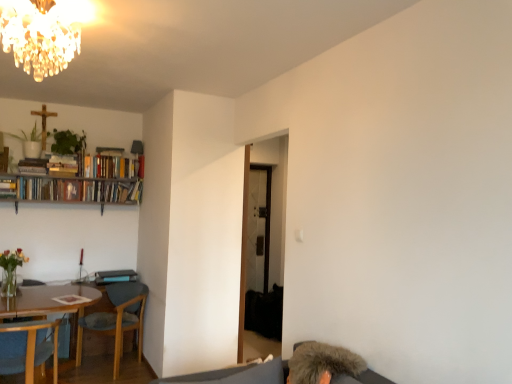
Question: Does green leafy plant at upper left, the 1th plant positioned from the right, contain wooden chair at lower left, placed as the second chair when sorted from back to front?

Choices:
 (A) yes
 (B) no

Answer: (B)

Question: Can you see green leafy plant at upper left, the 1th plant positioned from the right, touching wooden chair at lower left, placed as the second chair when sorted from back to front?

Choices:
 (A) no
 (B) yes

Answer: (A)

Question: From a real-world perspective, is green leafy plant at upper left, the 1th plant positioned from the right, located beneath wooden chair at lower left, placed as the second chair when sorted from back to front?

Choices:
 (A) yes
 (B) no

Answer: (B)

Question: Does green leafy plant at upper left, the 1th plant positioned from the right, lie in front of wooden chair at lower left, the 1th chair viewed from the front?

Choices:
 (A) no
 (B) yes

Answer: (A)

Question: From a real-world perspective, is green leafy plant at upper left, the 1th plant positioned from the right, located higher than wooden chair at lower left, placed as the second chair when sorted from back to front?

Choices:
 (A) yes
 (B) no

Answer: (A)

Question: Would you say fuzzy gray hair at lower right is inside or outside green matte plant at upper left, the 1th plant in the left-to-right sequence?

Choices:
 (A) inside
 (B) outside

Answer: (B)

Question: From a real-world perspective, is fuzzy gray hair at lower right physically located above or below green matte plant at upper left, the 1th plant in the left-to-right sequence?

Choices:
 (A) above
 (B) below

Answer: (B)

Question: From the image's perspective, is fuzzy gray hair at lower right above or below green matte plant at upper left, the 1th plant in the left-to-right sequence?

Choices:
 (A) above
 (B) below

Answer: (B)

Question: Based on their sizes in the image, would you say fuzzy gray hair at lower right is bigger or smaller than green matte plant at upper left, the 1th plant in the left-to-right sequence?

Choices:
 (A) small
 (B) big

Answer: (B)

Question: In terms of size, does hardcover books at upper left, the 2th book in the left-to-right sequence, appear bigger or smaller than hardcover book at left, arranged as the first book when viewed from the left?

Choices:
 (A) big
 (B) small

Answer: (A)

Question: In the image, is hardcover books at upper left, the 2th book in the left-to-right sequence, positioned in front of or behind hardcover book at left, arranged as the first book when viewed from the left?

Choices:
 (A) behind
 (B) front

Answer: (A)

Question: Would you say hardcover books at upper left, placed as the first book when sorted from right to left, is to the left or to the right of hardcover book at left, marked as the 2th book in a right-to-left arrangement, in the picture?

Choices:
 (A) right
 (B) left

Answer: (A)

Question: Is hardcover books at upper left, the 2th book in the left-to-right sequence, spatially inside hardcover book at left, marked as the 2th book in a right-to-left arrangement, or outside of it?

Choices:
 (A) outside
 (B) inside

Answer: (A)

Question: From the image's perspective, is green matte plant at upper left, arranged as the second plant when viewed from the right, located above or below wooden chair at lower left, the 1th chair when ordered from back to front?

Choices:
 (A) above
 (B) below

Answer: (A)

Question: From a real-world perspective, is green matte plant at upper left, arranged as the second plant when viewed from the right, positioned above or below wooden chair at lower left, the second chair when ordered from front to back?

Choices:
 (A) below
 (B) above

Answer: (B)